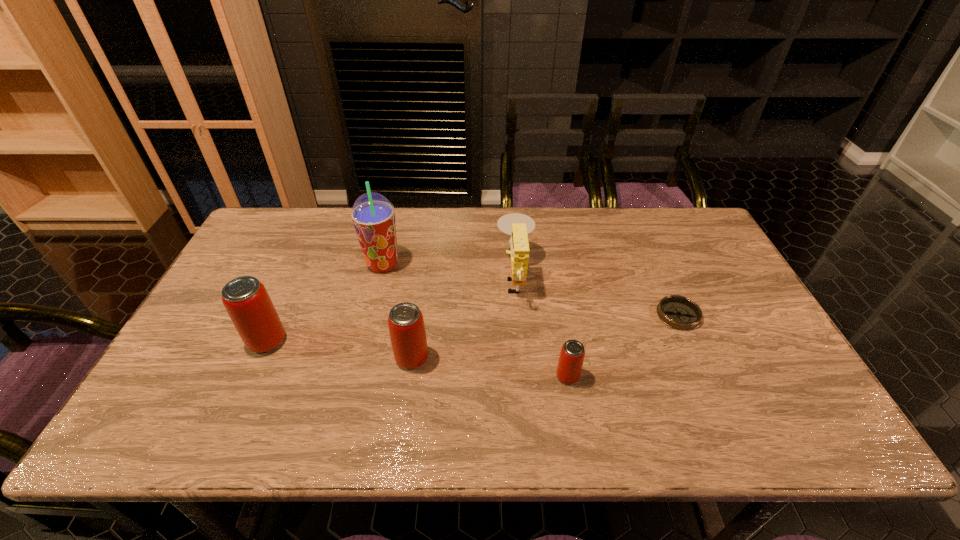
You are a GUI agent. You are given a task and a screenshot of the screen. Output one action in this format:
    pyautogui.click(x=<x>, y=<y>)
    Task: Click on the free location located on the right of the leftmost beer can
    The height and width of the screenshot is (540, 960).
    Given the screenshot: What is the action you would take?
    pyautogui.click(x=313, y=341)

You are a GUI agent. You are given a task and a screenshot of the screen. Output one action in this format:
    pyautogui.click(x=<x>, y=<y>)
    Task: Click on the blank space located on the right of the second tallest beer can
    The height and width of the screenshot is (540, 960).
    Given the screenshot: What is the action you would take?
    pyautogui.click(x=500, y=358)

Image resolution: width=960 pixels, height=540 pixels. Identify the location of free spot located 0.090m on the right of the shortest beer can. [x=616, y=376].

This screenshot has height=540, width=960. Identify the location of vacant space positioned on the left of the tallest object. click(256, 265).

Image resolution: width=960 pixels, height=540 pixels. Find the location of `vacant space located 0.200m on the front-facing side of the third object from right to left`. vacant space located 0.200m on the front-facing side of the third object from right to left is located at coordinates (430, 276).

Identify the location of vacant space positioned 0.310m on the front-facing side of the third object from right to left. The image size is (960, 540). (394, 276).

Where is `vacant region located 0.090m on the front-facing side of the third object from right to left`? The height and width of the screenshot is (540, 960). vacant region located 0.090m on the front-facing side of the third object from right to left is located at coordinates (467, 276).

This screenshot has width=960, height=540. Identify the location of blank space located 0.140m on the back of the shortest object. (658, 267).

Identify the location of object at the far edge. (517, 225).

The width and height of the screenshot is (960, 540). Identify the location of object present at the left edge. (247, 302).